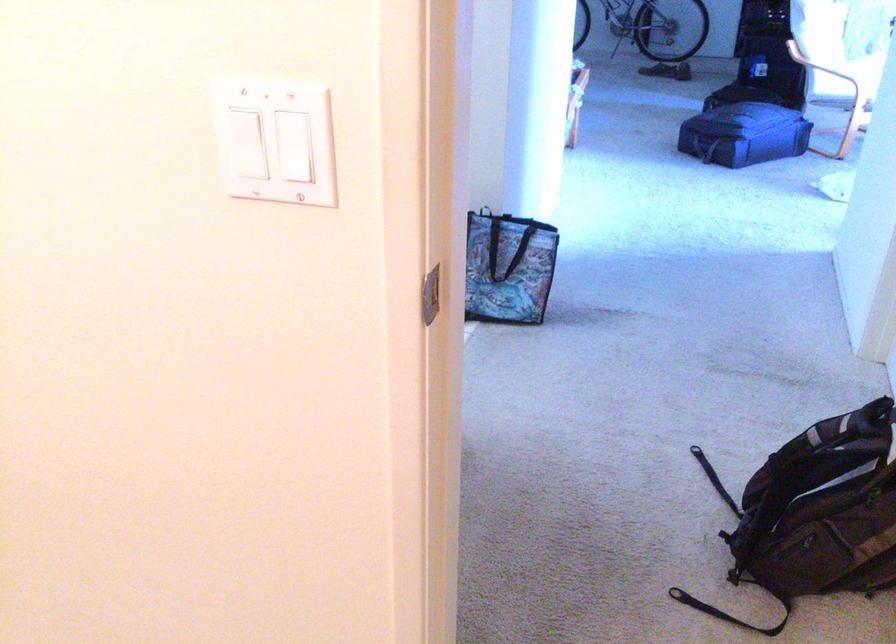
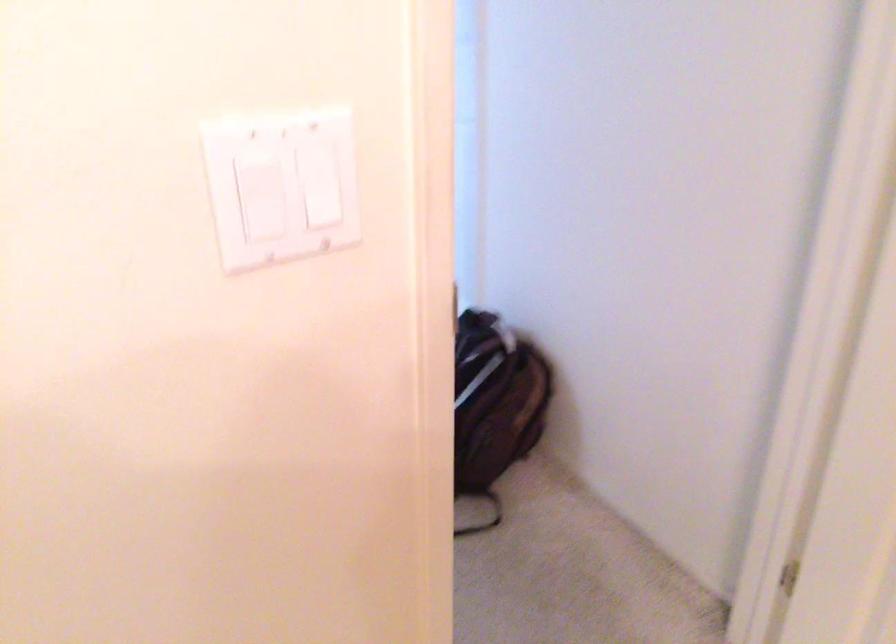
In the second image, find the point that corresponds to (227,116) in the first image.

(260, 194)